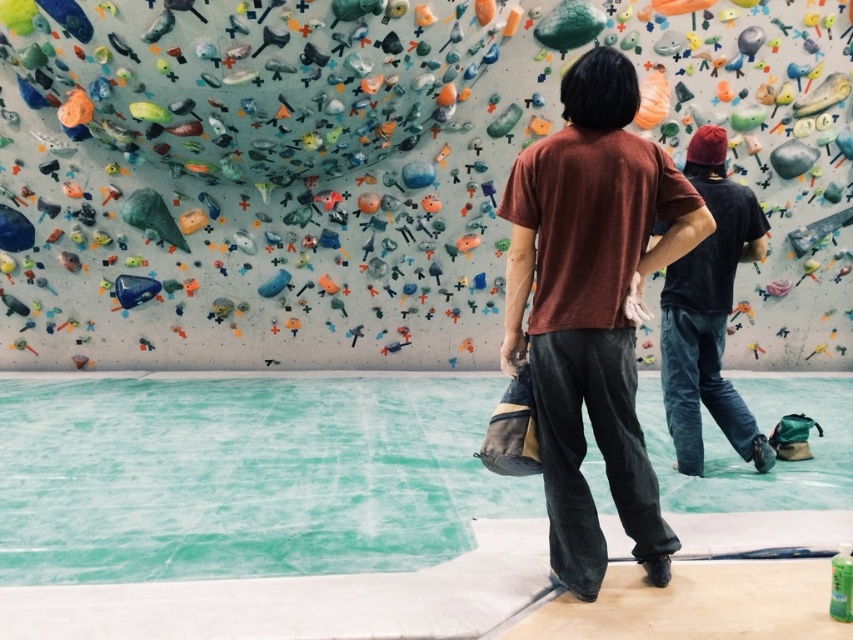
Based on the photo, you are standing at the base of the climbing wall in the indoor facility. There is a specific point marked at coordinates point (x=567, y=547) on the wall. If you want to reach this point with your hand, can you estimate whether it is within your arm reach?

The point (x=567, y=547) is 2.29 meters away from the viewer. Assuming an average arm reach of about 2 meters, the point is slightly out of reach.